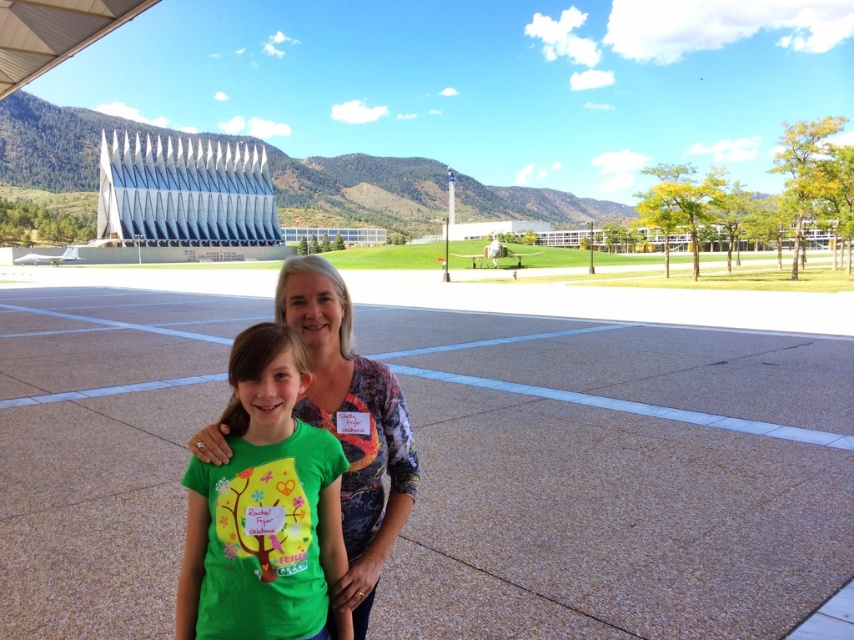
Does green concrete football field at center have a greater height compared to green matte shirt at center?

Yes, green concrete football field at center is taller than green matte shirt at center.

What do you see at coordinates (617, 477) in the screenshot? Image resolution: width=854 pixels, height=640 pixels. I see `green concrete football field at center` at bounding box center [617, 477].

Identify the location of green concrete football field at center. (617, 477).